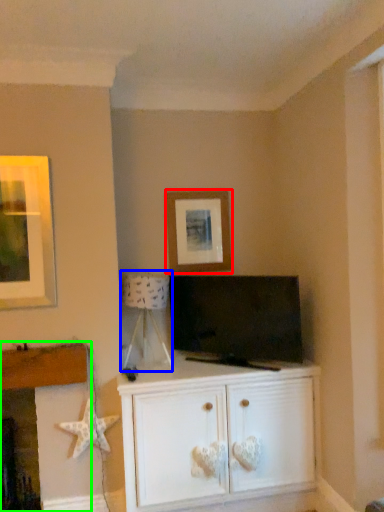
Question: Which object is the farthest from picture frame (highlighted by a red box)? Choose among these: lamp (highlighted by a blue box) or fireplace (highlighted by a green box).

Choices:
 (A) lamp
 (B) fireplace

Answer: (B)